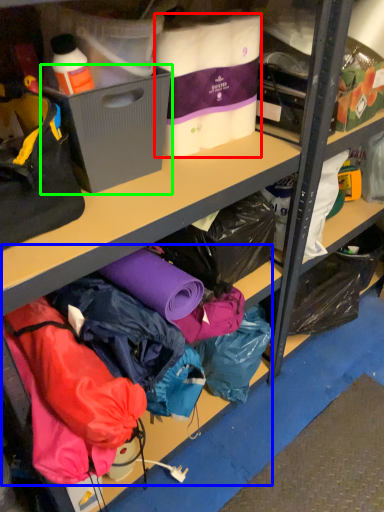
Question: Which object is the farthest from clothing (highlighted by a red box)? Choose among these: clothing (highlighted by a blue box) or box (highlighted by a green box).

Choices:
 (A) clothing
 (B) box

Answer: (A)